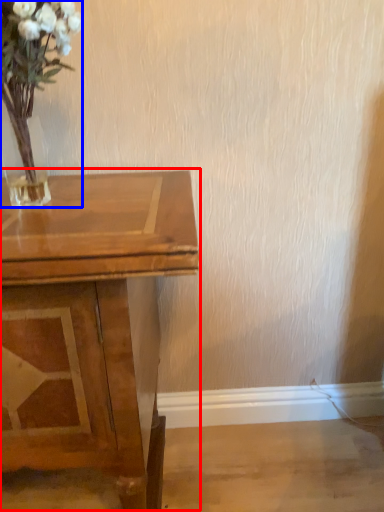
Question: Which object appears closest to the camera in this image, table (highlighted by a red box) or floral arrangement (highlighted by a blue box)?

Choices:
 (A) table
 (B) floral arrangement

Answer: (B)